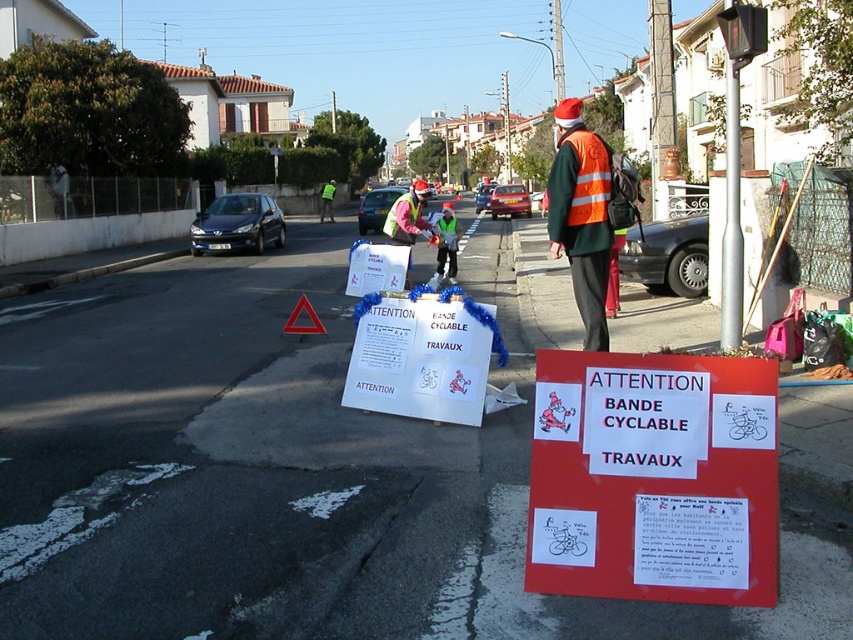
You are a delivery driver who needs to navigate through this construction zone. Your vehicle has a turning radius of 9 meters. Can you safely make a turn around the red matte sign at center and the reflective yellow safety vest at center without hitting either object?

The distance between the red matte sign at center and the reflective yellow safety vest at center is 8.78 meters. Since your vehicle has a turning radius of 9 meters, which is slightly larger than the distance between the two objects, you can safely make the turn without hitting either object.

Based on the photo, you are a drone operator trying to capture aerial footage of the roadwork area. You notice two points marked on your screen at coordinates point (550, 244) and point (405, 241). Which point should you focus on first if you want to capture the closest object to the camera?

Point (550, 244) is closer to the camera than point (405, 241), so you should focus on point (550, 244) first to capture the closest object.